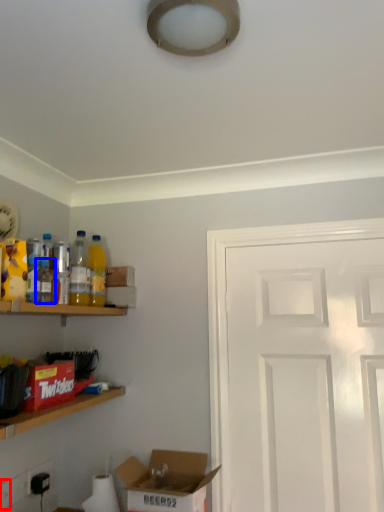
Question: Which object appears closest to the camera in this image, electric outlet (highlighted by a red box) or bottle (highlighted by a blue box)?

Choices:
 (A) electric outlet
 (B) bottle

Answer: (B)